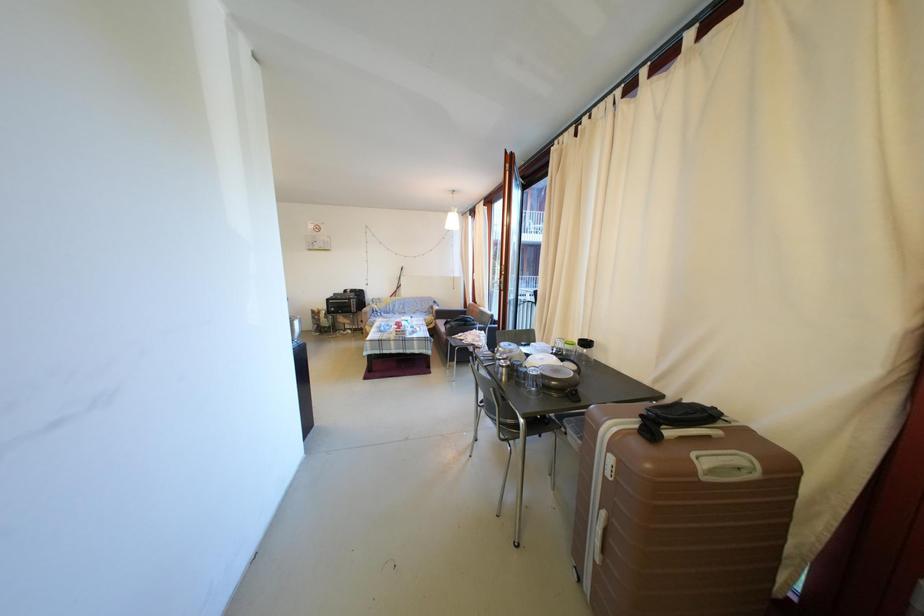
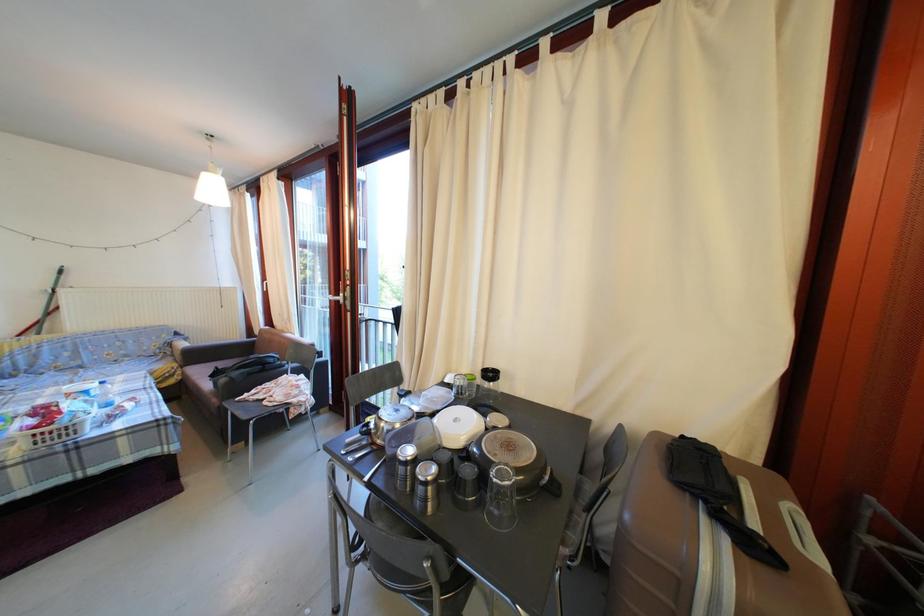
Question: The camera is either moving clockwise (left) or counter-clockwise (right) around the object. The first image is from the beginning of the video and the second image is from the end. Is the camera moving left or right when shooting the video?

Choices:
 (A) Left
 (B) Right

Answer: (A)